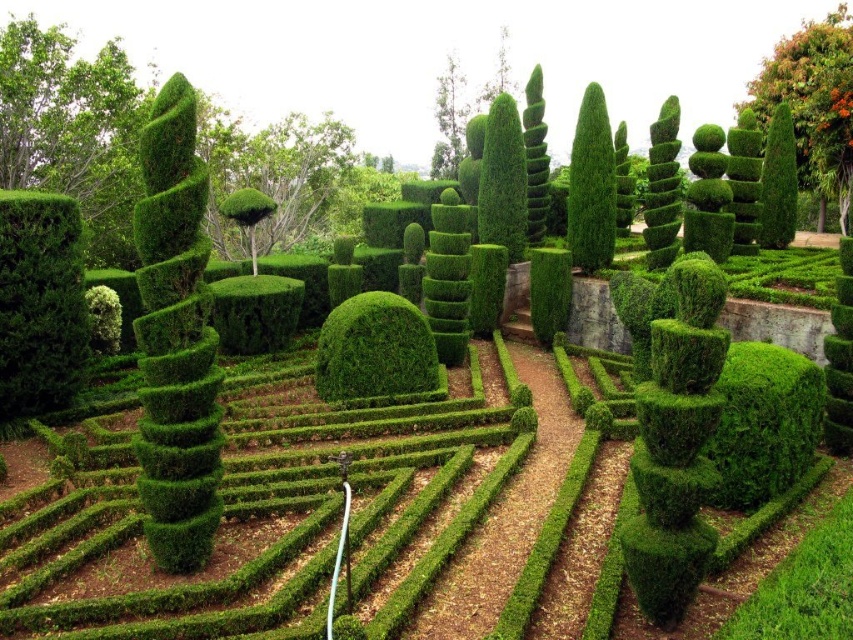
Question: In this image, where is green leafy bush at center located relative to green textured bush at center?

Choices:
 (A) above
 (B) below

Answer: (A)

Question: Which of the following is the farthest from the observer?

Choices:
 (A) (564, 250)
 (B) (454, 170)
 (C) (804, 145)

Answer: (B)

Question: In this image, where is green leafy bush at upper right located relative to green textured bush at center?

Choices:
 (A) above
 (B) below

Answer: (A)

Question: In this image, where is green leafy bush at center located relative to green leafy bush at upper right?

Choices:
 (A) above
 (B) below

Answer: (B)

Question: Considering the real-world distances, which object is farthest from the green leafy bush at upper right?

Choices:
 (A) green textured bush at left
 (B) green textured bush at center
 (C) green leafy tree at upper center
 (D) green leafy bush at center

Answer: (A)

Question: Estimate the real-world distances between objects in this image. Which object is closer to the green leafy bush at center?

Choices:
 (A) green leafy tree at upper center
 (B) green textured bush at center
 (C) green textured bush at left
 (D) green leafy bush at upper right

Answer: (A)